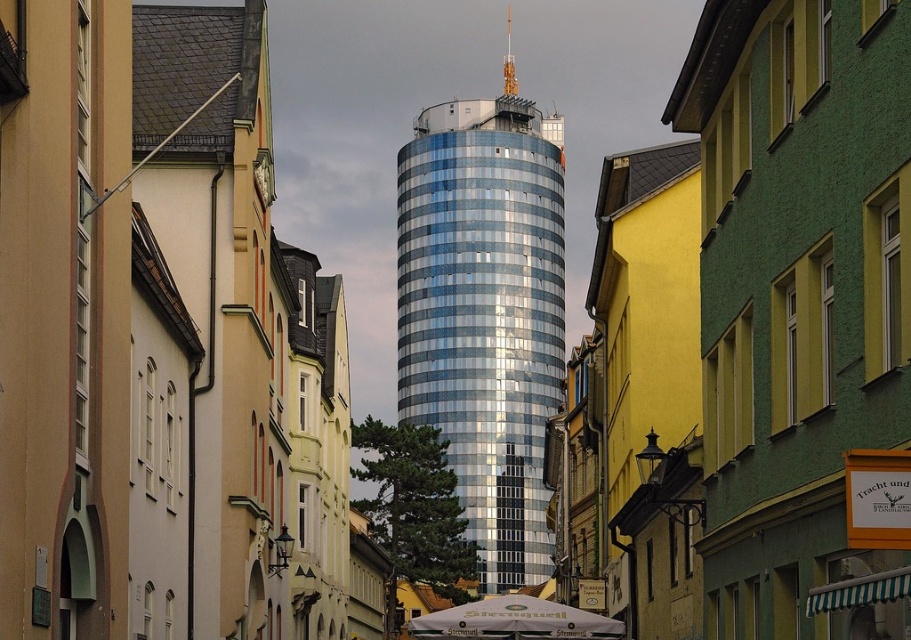
Question: Which is nearer to the sleek metallic tower at center?

Choices:
 (A) white fabric umbrella at center
 (B) green textured building at right

Answer: (A)

Question: In this image, where is green textured building at right located relative to sleek metallic tower at center?

Choices:
 (A) above
 (B) below

Answer: (B)

Question: Does green textured building at right appear under sleek metallic tower at center?

Choices:
 (A) yes
 (B) no

Answer: (A)

Question: Which object is farther from the camera taking this photo?

Choices:
 (A) green textured building at right
 (B) sleek metallic tower at center

Answer: (B)

Question: Does green textured building at right have a lesser width compared to white fabric umbrella at center?

Choices:
 (A) yes
 (B) no

Answer: (A)

Question: Among these objects, which one is nearest to the camera?

Choices:
 (A) green textured building at right
 (B) sleek metallic tower at center

Answer: (A)